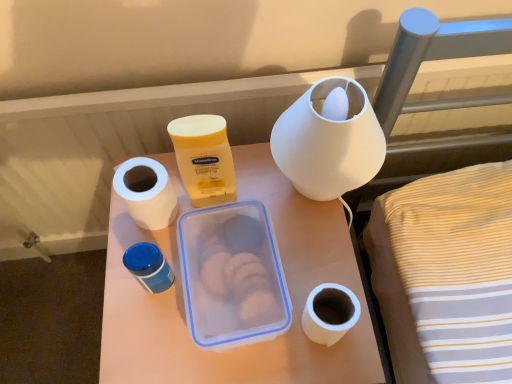
Question: Does yellow matte lotion at center have a lesser height compared to blue plastic container at center-left, which is the 1th pottery from bottom to top?

Choices:
 (A) no
 (B) yes

Answer: (A)

Question: Is yellow matte lotion at center in contact with blue plastic container at center-left, which is the 1th pottery from bottom to top?

Choices:
 (A) no
 (B) yes

Answer: (A)

Question: Is the position of yellow matte lotion at center more distant than that of blue plastic container at center-left, which is the 1th pottery from bottom to top?

Choices:
 (A) yes
 (B) no

Answer: (B)

Question: Can you confirm if yellow matte lotion at center is thinner than blue plastic container at center-left, which is counted as the first pottery, starting from the left?

Choices:
 (A) no
 (B) yes

Answer: (A)

Question: Considering the relative sizes of yellow matte lotion at center and blue plastic container at center-left, the second pottery viewed from the top, in the image provided, is yellow matte lotion at center taller than blue plastic container at center-left, the second pottery viewed from the top,?

Choices:
 (A) yes
 (B) no

Answer: (A)

Question: From a real-world perspective, is blue plastic container at center-left, which appears as the 2th pottery when viewed from the right, positioned above or below white matte lampshade at upper center, the first pottery viewed from the top?

Choices:
 (A) above
 (B) below

Answer: (B)

Question: Visually, is blue plastic container at center-left, the second pottery viewed from the top, positioned to the left or to the right of white matte lampshade at upper center, the first pottery viewed from the top?

Choices:
 (A) left
 (B) right

Answer: (A)

Question: Is blue plastic container at center-left, which is counted as the first pottery, starting from the left, in front of or behind white matte lampshade at upper center, which is counted as the 2th pottery, starting from the bottom, in the image?

Choices:
 (A) front
 (B) behind

Answer: (B)

Question: From the image's perspective, relative to white matte lampshade at upper center, arranged as the second pottery when viewed from the left, is blue plastic container at center-left, which is counted as the first pottery, starting from the left, above or below?

Choices:
 (A) above
 (B) below

Answer: (B)

Question: Visually, is yellow matte lotion at center positioned to the left or to the right of white matte lampshade at upper center, arranged as the second pottery when viewed from the left?

Choices:
 (A) right
 (B) left

Answer: (B)

Question: Do you think yellow matte lotion at center is within white matte lampshade at upper center, arranged as the 1th pottery when viewed from the right, or outside of it?

Choices:
 (A) inside
 (B) outside

Answer: (B)

Question: Is yellow matte lotion at center taller or shorter than white matte lampshade at upper center, arranged as the 1th pottery when viewed from the right?

Choices:
 (A) tall
 (B) short

Answer: (B)

Question: From the image's perspective, relative to white matte lampshade at upper center, arranged as the second pottery when viewed from the left, is yellow matte lotion at center above or below?

Choices:
 (A) below
 (B) above

Answer: (A)

Question: Based on their positions, is white plastic container at center located to the left or right of white matte paper towel at left?

Choices:
 (A) right
 (B) left

Answer: (A)

Question: In terms of size, does white plastic container at center appear bigger or smaller than white matte paper towel at left?

Choices:
 (A) big
 (B) small

Answer: (A)